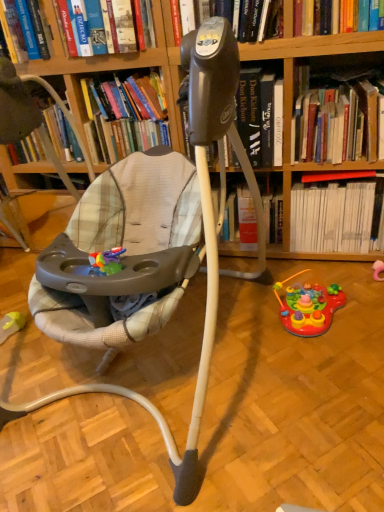
Image resolution: width=384 pixels, height=512 pixels. What are the coordinates of `vacant area that lies between rubberized plastic activity center at lower right, the 2th toy positioned from the left, and pink rubber toy at lower right, the 1th toy viewed from the right` in the screenshot? It's located at (360, 295).